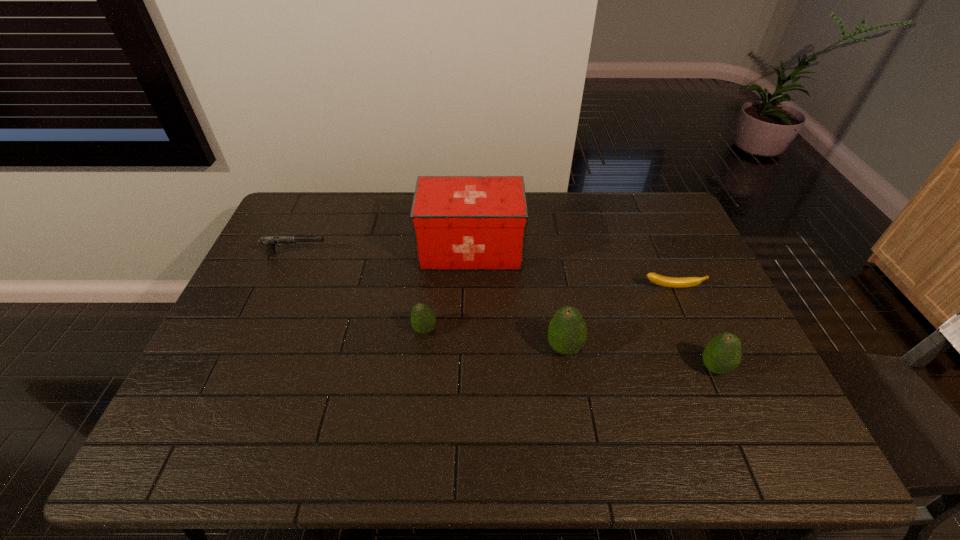
This screenshot has height=540, width=960. I want to click on free point that keeps the avocados evenly spaced on the left, so click(x=295, y=313).